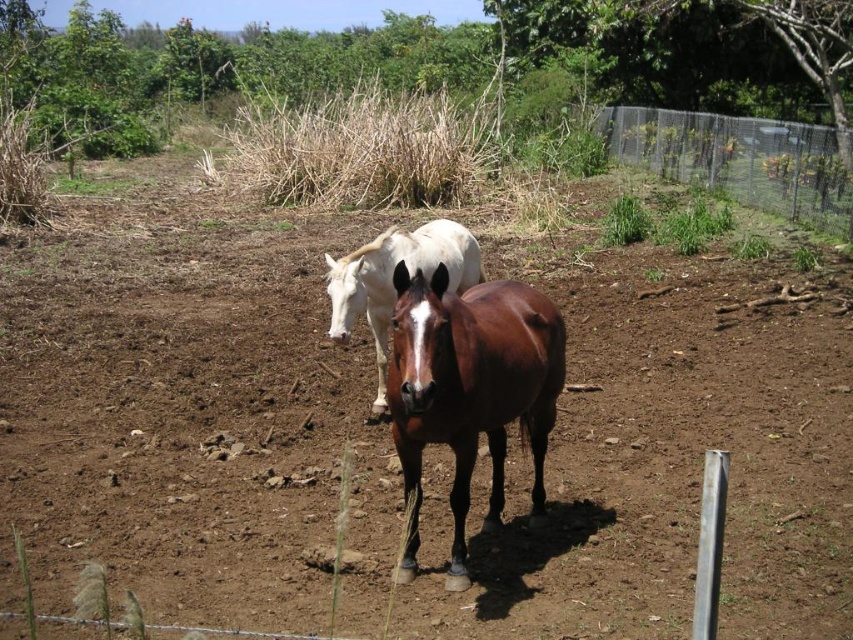
Who is positioned more to the left, metallic wire mesh at upper right or white glossy horse at center?

white glossy horse at center

Can you confirm if metallic wire mesh at upper right is positioned to the right of white glossy horse at center?

Indeed, metallic wire mesh at upper right is positioned on the right side of white glossy horse at center.

Find the location of `metallic wire mesh at upper right`. metallic wire mesh at upper right is located at coordinates (738, 160).

Is brown glossy horse at center to the left of metallic wire mesh at upper right from the viewer's perspective?

Correct, you'll find brown glossy horse at center to the left of metallic wire mesh at upper right.

Locate an element on the screen. The width and height of the screenshot is (853, 640). brown glossy horse at center is located at coordinates (469, 388).

This screenshot has height=640, width=853. Find the location of `brown glossy horse at center`. brown glossy horse at center is located at coordinates (469, 388).

What are the coordinates of `brown glossy horse at center` in the screenshot? It's located at (469, 388).

Between brown glossy horse at center and white glossy horse at center, which one is positioned higher?

white glossy horse at center is higher up.

Who is more forward, (425, 403) or (419, 257)?

Point (425, 403) is in front.

Where is `brown glossy horse at center`? brown glossy horse at center is located at coordinates (469, 388).